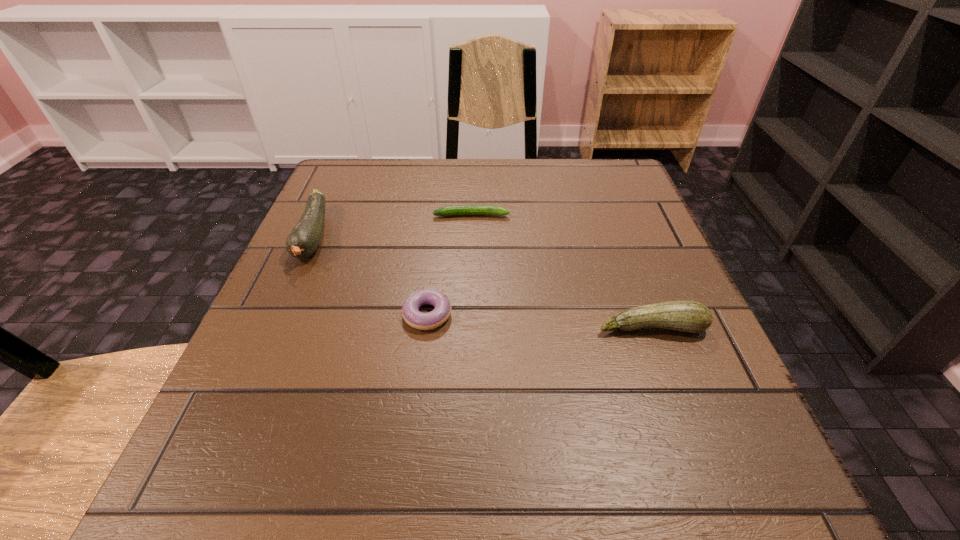
At what (x,y) coordinates should I click in order to perform the action: click on the leftmost zucchini. Please return your answer as a coordinate pair (x, y). The image size is (960, 540). Looking at the image, I should click on (304, 239).

You are a GUI agent. You are given a task and a screenshot of the screen. Output one action in this format:
    pyautogui.click(x=<x>, y=<y>)
    Task: Click on the rightmost object
    The height and width of the screenshot is (540, 960).
    Given the screenshot: What is the action you would take?
    pyautogui.click(x=686, y=316)

The height and width of the screenshot is (540, 960). Find the location of `the rightmost zucchini`. the rightmost zucchini is located at coordinates (686, 316).

What are the coordinates of `doughnut` in the screenshot? It's located at (410, 311).

This screenshot has width=960, height=540. I want to click on the second zucchini from right to left, so click(x=456, y=210).

Find the location of a particular element. the shortest zucchini is located at coordinates (456, 210).

Locate an element on the screen. free space located 0.390m at the blossom end of the leftmost zucchini is located at coordinates (203, 486).

This screenshot has width=960, height=540. Find the location of `vacant space positioned at the stem end of the nearest zucchini`. vacant space positioned at the stem end of the nearest zucchini is located at coordinates (677, 394).

In order to click on free location located 0.200m on the back of the doughnut in this screenshot , I will do `click(438, 229)`.

This screenshot has height=540, width=960. I want to click on vacant space located 0.300m on the front-facing side of the shortest object, so click(x=647, y=215).